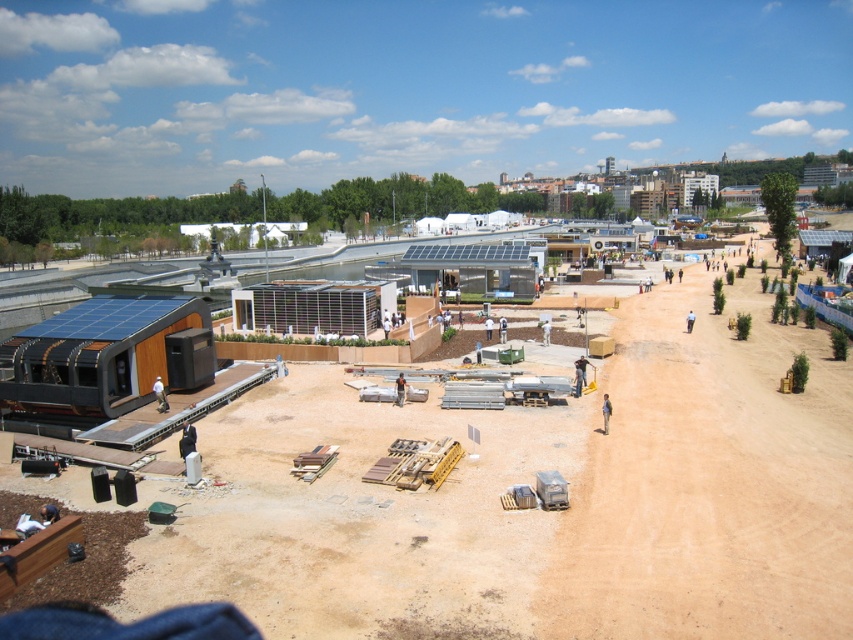
Question: Is brown wooden construction site at center above brown dirt track at center?

Choices:
 (A) yes
 (B) no

Answer: (B)

Question: Which of the following is the farthest from the observer?

Choices:
 (A) brown wooden construction site at center
 (B) brown dirt track at center

Answer: (B)

Question: Which point is farther to the camera?

Choices:
 (A) brown wooden construction site at center
 (B) brown dirt track at center

Answer: (B)

Question: Is brown wooden construction site at center wider than brown dirt track at center?

Choices:
 (A) yes
 (B) no

Answer: (A)

Question: In this image, where is brown wooden construction site at center located relative to brown dirt track at center?

Choices:
 (A) left
 (B) right

Answer: (A)

Question: Which point is farther from the camera taking this photo?

Choices:
 (A) (766, 554)
 (B) (590, 592)

Answer: (A)